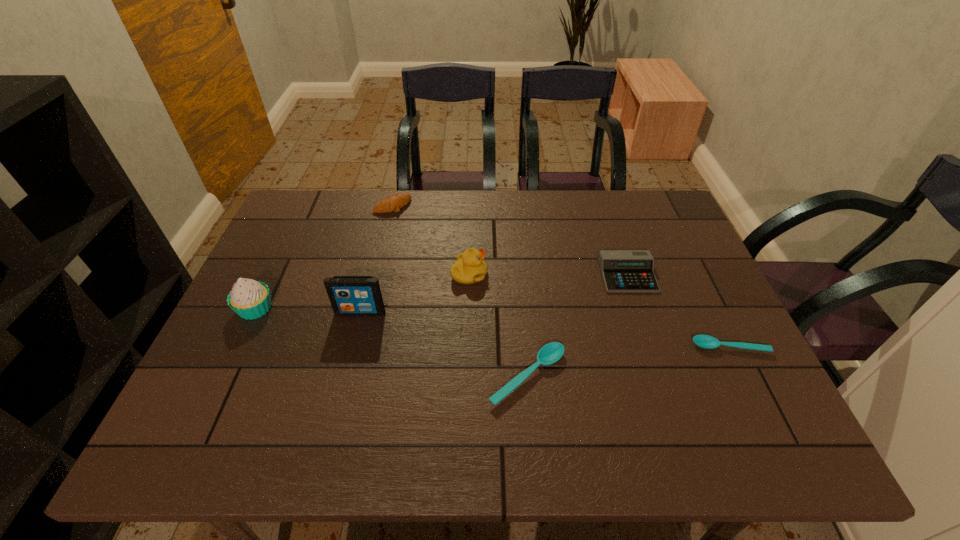
Image resolution: width=960 pixels, height=540 pixels. What are the coordinates of `the second shortest object` in the screenshot? It's located at (549, 354).

This screenshot has width=960, height=540. What are the coordinates of `the taller spoon` in the screenshot? It's located at (549, 354).

The height and width of the screenshot is (540, 960). I want to click on the shorter spoon, so [x=704, y=341].

Find the location of a particular element. the right spoon is located at coordinates (704, 341).

The width and height of the screenshot is (960, 540). Identify the location of crescent roll. (394, 202).

At what (x,y) coordinates should I click in order to perform the action: click on iPod. Please return your answer as a coordinate pair (x, y). Looking at the image, I should click on (349, 295).

Where is `the sixth object from left to right`? the sixth object from left to right is located at coordinates click(x=622, y=270).

Find the location of a particular element. duckling is located at coordinates (469, 268).

Find the location of a particular element. The height and width of the screenshot is (540, 960). cupcake is located at coordinates (250, 299).

Identify the location of vacant area located on the back of the left spoon. The height and width of the screenshot is (540, 960). (520, 292).